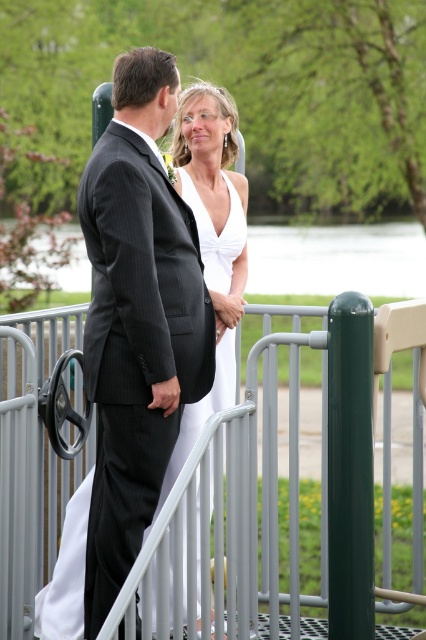
You are a photographer at a wedding and need to adjust the lighting to ensure both the matte black suit at center and the white satin dress at center are well illuminated. Considering their heights, which one might require more direct light to avoid appearing too dark?

The matte black suit at center is taller than the white satin dress at center, so the taller suit may need more direct light to ensure it is adequately illuminated compared to the shorter dress.

You are standing at point [95,376] and want to walk to point [293,472]. Which direction should you move in relation to the couple?

You should move behind the couple to reach point [293,472] since it is located behind point [95,376].